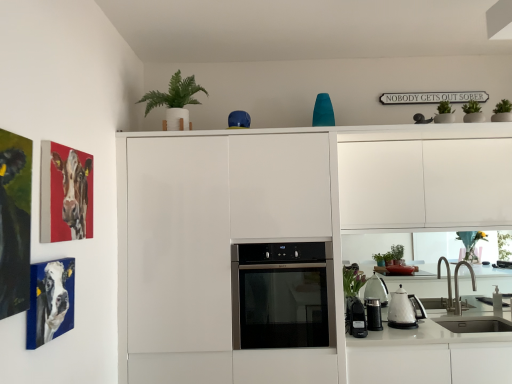
Where is `matte canvas painting of cow at upper left, placed as the third picture frame when sorted from front to back`? The height and width of the screenshot is (384, 512). matte canvas painting of cow at upper left, placed as the third picture frame when sorted from front to back is located at coordinates (65, 193).

In order to click on metallic black coffee grinder at lower center, which is counted as the first appliance, starting from the right in this screenshot , I will do [x=373, y=314].

Measure the distance between point (x=359, y=330) and camera.

Point (x=359, y=330) and camera are 8.37 feet apart from each other.

The height and width of the screenshot is (384, 512). In order to click on silver metallic faucet at lower right in this screenshot , I will do `click(458, 285)`.

This screenshot has width=512, height=384. What do you see at coordinates (458, 285) in the screenshot? I see `silver metallic faucet at lower right` at bounding box center [458, 285].

Locate an element on the screen. The image size is (512, 384). matte canvas painting of cow at upper left, which is the first picture frame from back to front is located at coordinates click(x=65, y=193).

Is white glossy kettle at lower right inside the boundaries of metallic black coffee grinder at lower center, acting as the second appliance starting from the left, or outside?

white glossy kettle at lower right is outside metallic black coffee grinder at lower center, acting as the second appliance starting from the left.

From the image's perspective, which object appears higher, white glossy kettle at lower right or metallic black coffee grinder at lower center, which is counted as the first appliance, starting from the right?

white glossy kettle at lower right is shown above in the image.

Which is nearer, (399, 297) or (366, 303)?

Point (399, 297) is positioned closer to the camera compared to point (366, 303).

Is point (150, 95) positioned in front of point (288, 276)?

That is False.

Is green matte plant at upper center taller than satin black oven at center?

No, green matte plant at upper center is not taller than satin black oven at center.

In the scene shown: Which is correct: green matte plant at upper center is inside satin black oven at center, or outside of it?

green matte plant at upper center is outside satin black oven at center.

In the scene shown: Is green matte plant at upper center further to camera compared to satin black oven at center?

Yes, the depth of green matte plant at upper center is greater than that of satin black oven at center.

Who is more distant, metallic black coffee grinder at lower center, which is counted as the first appliance, starting from the right, or blue glossy canvas at left, the 2th picture frame from the back?

metallic black coffee grinder at lower center, which is counted as the first appliance, starting from the right, is further away from the camera.

Where is `appliance that is the 2nd object directly below the blue glossy canvas at left, the 2th picture frame from the back (from a real-world perspective)`? This screenshot has height=384, width=512. appliance that is the 2nd object directly below the blue glossy canvas at left, the 2th picture frame from the back (from a real-world perspective) is located at coordinates (373, 314).

Considering the relative sizes of metallic black coffee grinder at lower center, which is counted as the first appliance, starting from the right, and blue glossy canvas at left, the second picture frame in the front-to-back sequence, in the image provided, is metallic black coffee grinder at lower center, which is counted as the first appliance, starting from the right, shorter than blue glossy canvas at left, the second picture frame in the front-to-back sequence,?

Yes.

Considering the relative sizes of metallic black coffee grinder at lower center, which is counted as the first appliance, starting from the right, and blue glossy canvas at left, the second picture frame in the front-to-back sequence, in the image provided, is metallic black coffee grinder at lower center, which is counted as the first appliance, starting from the right, thinner than blue glossy canvas at left, the second picture frame in the front-to-back sequence,?

Incorrect, the width of metallic black coffee grinder at lower center, which is counted as the first appliance, starting from the right, is not less than that of blue glossy canvas at left, the second picture frame in the front-to-back sequence.

The image size is (512, 384). Identify the location of the 2nd picture frame to the left of the white glossy kettle at lower right, starting your count from the anchor. (65, 193).

Is matte canvas painting of cow at upper left, placed as the third picture frame when sorted from front to back, aimed at white glossy kettle at lower right?

No.

Which object is positioned more to the left, matte canvas painting of cow at upper left, which is the first picture frame from back to front, or white glossy kettle at lower right?

matte canvas painting of cow at upper left, which is the first picture frame from back to front, is more to the left.

Is matte canvas painting of cow at upper left, placed as the third picture frame when sorted from front to back, next to white glossy kettle at lower right?

matte canvas painting of cow at upper left, placed as the third picture frame when sorted from front to back, and white glossy kettle at lower right are not in contact.

Who is smaller, satin black oven at center or metallic black coffee grinder at lower center, which is counted as the first appliance, starting from the right?

metallic black coffee grinder at lower center, which is counted as the first appliance, starting from the right.

From the image's perspective, is satin black oven at center over metallic black coffee grinder at lower center, acting as the second appliance starting from the left?

Correct, satin black oven at center appears higher than metallic black coffee grinder at lower center, acting as the second appliance starting from the left, in the image.

Which is behind, point (326, 297) or point (370, 327)?

The point (370, 327) is behind.

Does black plastic power strip at lower right, the 1th appliance when ordered from left to right, turn towards blue glossy canvas at left, the 2th picture frame from the back?

No, black plastic power strip at lower right, the 1th appliance when ordered from left to right, is not aimed at blue glossy canvas at left, the 2th picture frame from the back.

Between black plastic power strip at lower right, which is the 2th appliance from right to left, and blue glossy canvas at left, the second picture frame in the front-to-back sequence, which one is positioned in front?

Positioned in front is blue glossy canvas at left, the second picture frame in the front-to-back sequence.

Measure the distance from black plastic power strip at lower right, the 1th appliance when ordered from left to right, to blue glossy canvas at left, the 2th picture frame from the back.

A distance of 5.43 feet exists between black plastic power strip at lower right, the 1th appliance when ordered from left to right, and blue glossy canvas at left, the 2th picture frame from the back.

Is black plastic power strip at lower right, which is the 2th appliance from right to left, not near blue glossy canvas at left, the 2th picture frame from the back?

Absolutely, black plastic power strip at lower right, which is the 2th appliance from right to left, is distant from blue glossy canvas at left, the 2th picture frame from the back.

Who is smaller, black plastic power strip at lower right, which is the 2th appliance from right to left, or silver metallic faucet at lower right?

Smaller between the two is black plastic power strip at lower right, which is the 2th appliance from right to left.

Does black plastic power strip at lower right, which is the 2th appliance from right to left, have a lesser height compared to silver metallic faucet at lower right?

Yes, black plastic power strip at lower right, which is the 2th appliance from right to left, is shorter than silver metallic faucet at lower right.

Is black plastic power strip at lower right, the 1th appliance when ordered from left to right, positioned with its back to silver metallic faucet at lower right?

No.

This screenshot has height=384, width=512. Identify the location of the 1st appliance in front of the white glossy kettle at lower right, counting from the anchor's position. (373, 314).

Locate an element on the screen. oven below the green matte plant at upper center (from a real-world perspective) is located at coordinates (281, 296).

Based on their spatial positions, is dark green matte painting at left, marked as the 3th picture frame in a back-to-front arrangement, or satin black oven at center closer to black plastic power strip at lower right, the 1th appliance when ordered from left to right?

satin black oven at center lies closer to black plastic power strip at lower right, the 1th appliance when ordered from left to right, than the other object.

From the image, which object appears to be nearer to dark green matte painting at left, marked as the 3th picture frame in a back-to-front arrangement, satin black oven at center or matte canvas painting of cow at upper left, placed as the third picture frame when sorted from front to back?

matte canvas painting of cow at upper left, placed as the third picture frame when sorted from front to back, is closer to dark green matte painting at left, marked as the 3th picture frame in a back-to-front arrangement.

From the image, which object appears to be nearer to dark green matte painting at left, which is the 1th picture frame from front to back, matte canvas painting of cow at upper left, placed as the third picture frame when sorted from front to back, or silver metallic faucet at lower right?

The object closer to dark green matte painting at left, which is the 1th picture frame from front to back, is matte canvas painting of cow at upper left, placed as the third picture frame when sorted from front to back.

When comparing their distances from dark green matte painting at left, marked as the 3th picture frame in a back-to-front arrangement, does green matte plant at upper center or blue glossy canvas at left, the 2th picture frame from the back, seem further?

Based on the image, green matte plant at upper center appears to be further to dark green matte painting at left, marked as the 3th picture frame in a back-to-front arrangement.

Estimate the real-world distances between objects in this image. Which object is further from white glossy kettle at lower right, black plastic power strip at lower right, the 1th appliance when ordered from left to right, or satin black oven at center?

satin black oven at center is further to white glossy kettle at lower right.

Estimate the real-world distances between objects in this image. Which object is further from white glossy kettle at lower right, matte canvas painting of cow at upper left, placed as the third picture frame when sorted from front to back, or metallic black coffee grinder at lower center, acting as the second appliance starting from the left?

matte canvas painting of cow at upper left, placed as the third picture frame when sorted from front to back, is further to white glossy kettle at lower right.

Consider the image. Which object lies nearer to the anchor point blue glossy canvas at left, the second picture frame in the front-to-back sequence, green matte plant at upper center or silver metallic faucet at lower right?

green matte plant at upper center lies closer to blue glossy canvas at left, the second picture frame in the front-to-back sequence, than the other object.

Looking at the image, which one is located further to matte canvas painting of cow at upper left, placed as the third picture frame when sorted from front to back, metallic black coffee grinder at lower center, which is counted as the first appliance, starting from the right, or black plastic power strip at lower right, the 1th appliance when ordered from left to right?

metallic black coffee grinder at lower center, which is counted as the first appliance, starting from the right, is positioned further to the anchor matte canvas painting of cow at upper left, placed as the third picture frame when sorted from front to back.

Locate an element on the screen. This screenshot has width=512, height=384. houseplant between matte canvas painting of cow at upper left, which is the first picture frame from back to front, and metallic black coffee grinder at lower center, which is counted as the first appliance, starting from the right is located at coordinates (175, 101).

The width and height of the screenshot is (512, 384). Find the location of `picture frame positioned between blue glossy canvas at left, the second picture frame in the front-to-back sequence, and green matte plant at upper center from near to far`. picture frame positioned between blue glossy canvas at left, the second picture frame in the front-to-back sequence, and green matte plant at upper center from near to far is located at coordinates click(65, 193).

Identify the location of appliance between green matte plant at upper center and metallic black coffee grinder at lower center, acting as the second appliance starting from the left, vertically. The image size is (512, 384). (355, 318).

Where is `oven between matte canvas painting of cow at upper left, placed as the third picture frame when sorted from front to back, and black plastic power strip at lower right, which is the 2th appliance from right to left, in the horizontal direction`? This screenshot has height=384, width=512. oven between matte canvas painting of cow at upper left, placed as the third picture frame when sorted from front to back, and black plastic power strip at lower right, which is the 2th appliance from right to left, in the horizontal direction is located at coordinates (281, 296).